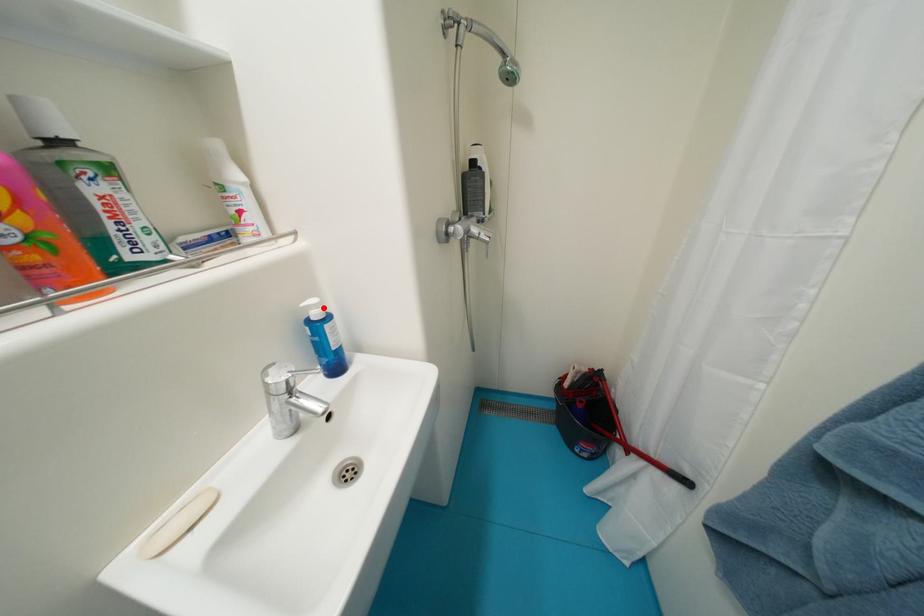
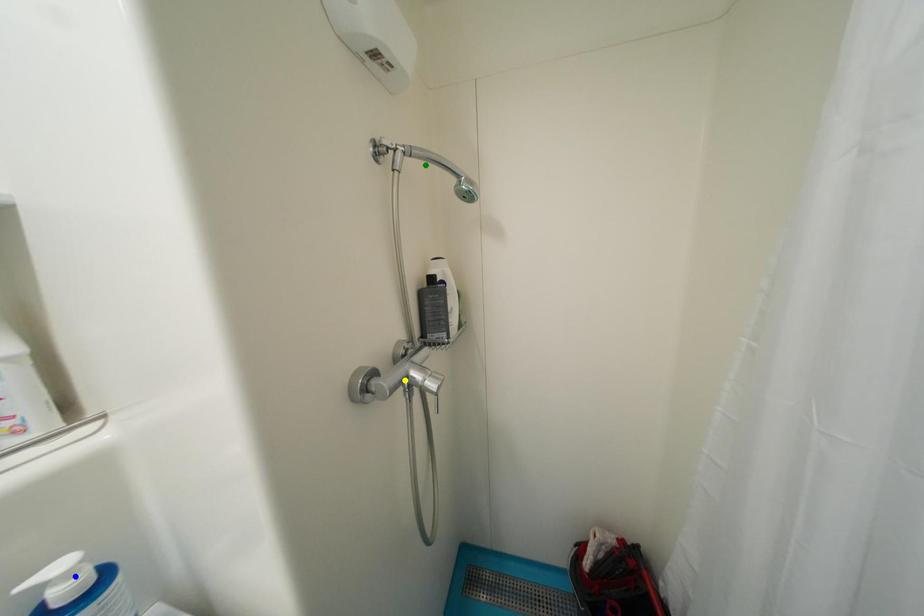
Question: I am providing you with two images of the same scene from different viewpoints. A red point is marked on the first image. You are given multiple points on the second image. Which point in image 2 represents the same 3d spot as the red point in image 1?

Choices:
 (A) yellow point
 (B) blue point
 (C) green point

Answer: (B)